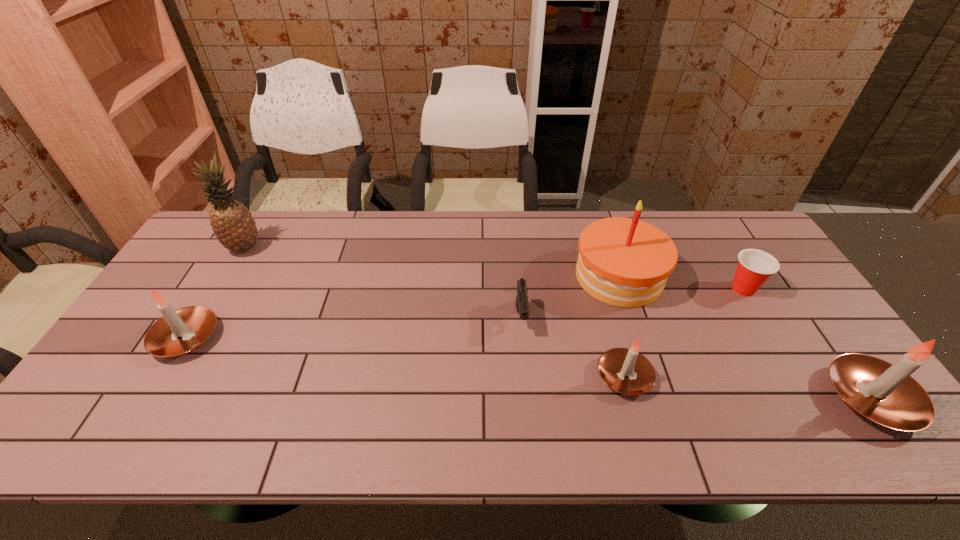
The height and width of the screenshot is (540, 960). What are the coordinates of `free point between the leftmost candle and the cup` in the screenshot? It's located at (465, 313).

Where is `free spot between the fourth shortest object and the fifth tallest object`? This screenshot has width=960, height=540. free spot between the fourth shortest object and the fifth tallest object is located at coordinates (405, 357).

Image resolution: width=960 pixels, height=540 pixels. What are the coordinates of `free space between the sixth shortest object and the cup` in the screenshot? It's located at (681, 282).

At what (x,y) coordinates should I click in order to perform the action: click on vacant region between the birthday cake and the fifth shortest object. Please return your answer as a coordinate pair (x, y). Looking at the image, I should click on (745, 338).

Locate an element on the screen. This screenshot has width=960, height=540. vacant region between the fifth object from right to left and the pineapple is located at coordinates (383, 283).

Find the location of a particular element. The image size is (960, 540). vacant point located between the cup and the pineapple is located at coordinates (493, 268).

Identify the location of empty location between the rightmost candle and the birthday cake. This screenshot has height=540, width=960. (745, 338).

At what (x,y) coordinates should I click in order to perform the action: click on vacant area that lies between the cup and the sixth shortest object. Please return your answer as a coordinate pair (x, y). Image resolution: width=960 pixels, height=540 pixels. Looking at the image, I should click on (681, 282).

The height and width of the screenshot is (540, 960). In order to click on object that is the fourth closest to the tallest candle in this screenshot , I will do `click(522, 307)`.

Choose which object is the fifth nearest neighbor to the third object from left to right. Please provide its 2D coordinates. Your answer should be formatted as a tuple, i.e. [(x, y)], where the tuple contains the x and y coordinates of a point satisfying the conditions above.

[(181, 331)]